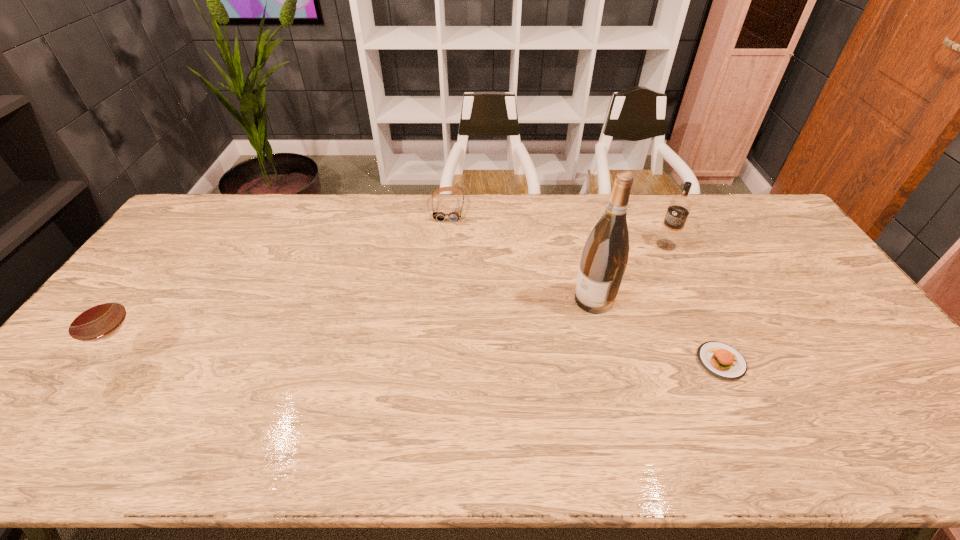
Identify which object is the fourth closest to the farthest object. Please provide its 2D coordinates. Your answer should be formatted as a tuple, i.e. [(x, y)], where the tuple contains the x and y coordinates of a point satisfying the conditions above.

[(96, 316)]

You are a GUI agent. You are given a task and a screenshot of the screen. Output one action in this format:
    pyautogui.click(x=<x>, y=<y>)
    Task: Click on the vacant area that satisfies the following two spatial constraints: 1. on the front side of the food; 2. on the right side of the third nearest object
    Image resolution: width=960 pixels, height=540 pixels.
    Given the screenshot: What is the action you would take?
    pyautogui.click(x=610, y=361)

At what (x,y) coordinates should I click in order to perform the action: click on vacant point that satisfies the following two spatial constraints: 1. on the back side of the leftmost object; 2. on the right side of the second object from left to right. Please return your answer as a coordinate pair (x, y). The height and width of the screenshot is (540, 960). Looking at the image, I should click on (238, 208).

Identify the location of free location that satisfies the following two spatial constraints: 1. on the back side of the third shortest object; 2. on the left side of the third farthest object. (176, 300).